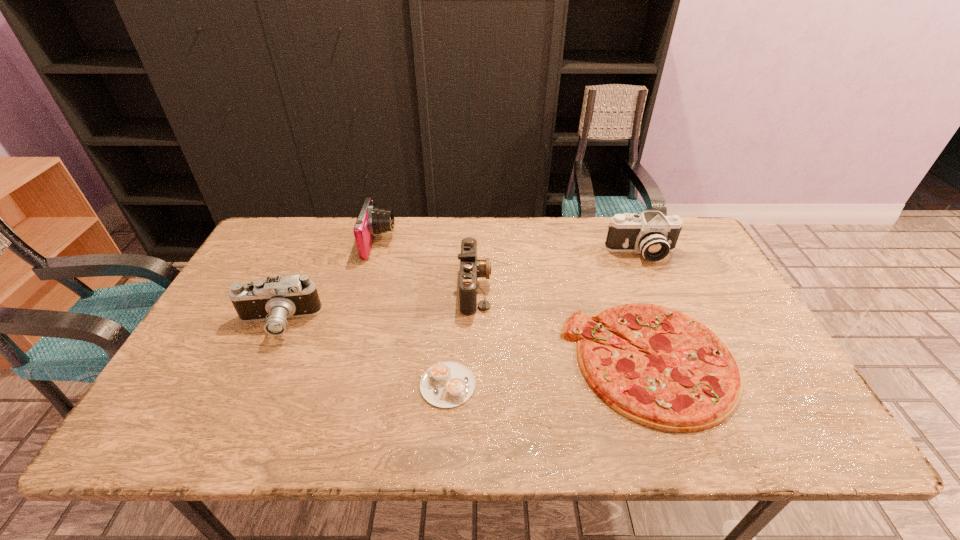
Identify the location of free space in the image that satisfies the following two spatial constraints: 1. on the front-facing side of the third camera from left to right; 2. on the front side of the shortest object. This screenshot has height=540, width=960. (473, 384).

Where is `vacant space that satisfies the following two spatial constraints: 1. at the lens of the pizza; 2. on the left side of the leftmost camera`? vacant space that satisfies the following two spatial constraints: 1. at the lens of the pizza; 2. on the left side of the leftmost camera is located at coordinates (260, 361).

Locate an element on the screen. free space that satisfies the following two spatial constraints: 1. on the front-facing side of the pizza; 2. on the left side of the third camera from left to right is located at coordinates point(474,361).